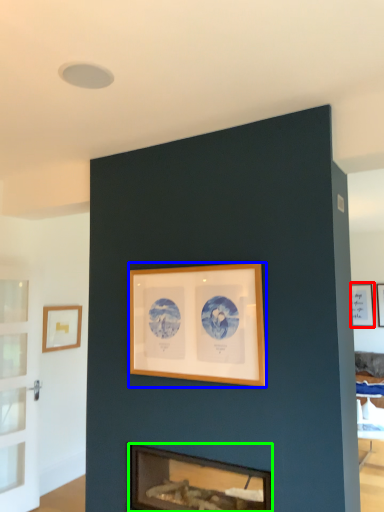
Question: Which is nearer to the picture frame (highlighted by a red box)? picture frame (highlighted by a blue box) or fireplace (highlighted by a green box).

Choices:
 (A) picture frame
 (B) fireplace

Answer: (A)